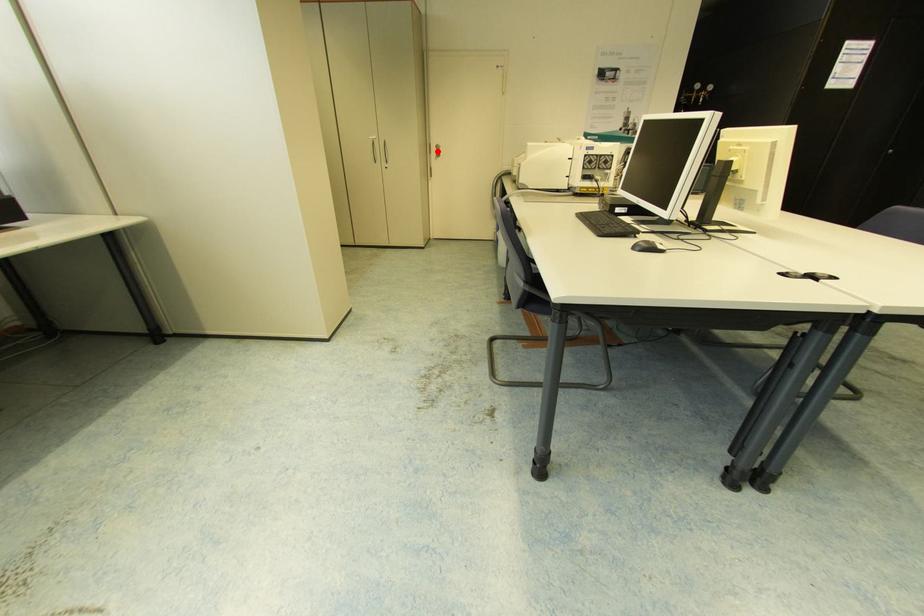
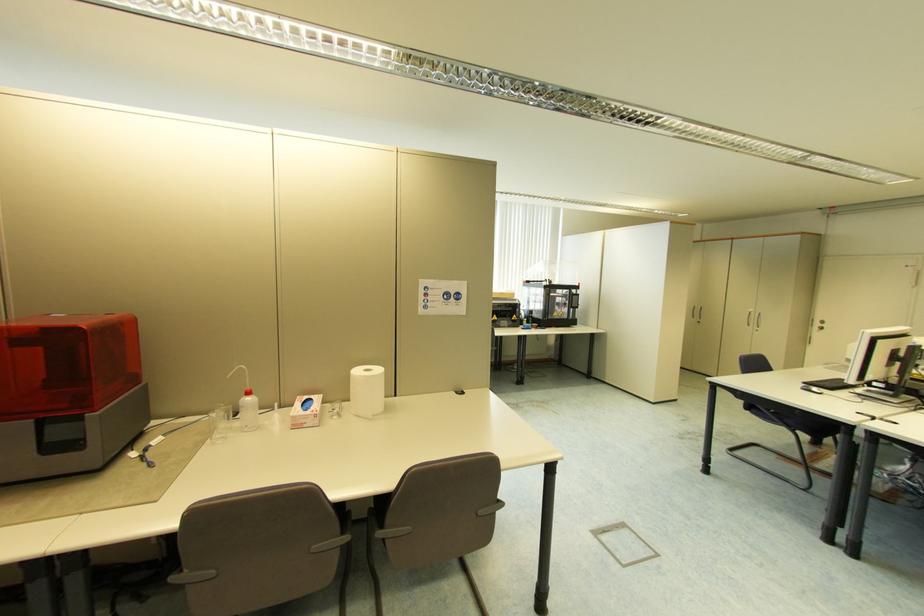
In the second image, find the point that corresponds to the highlighted location in the first image.

(821, 325)